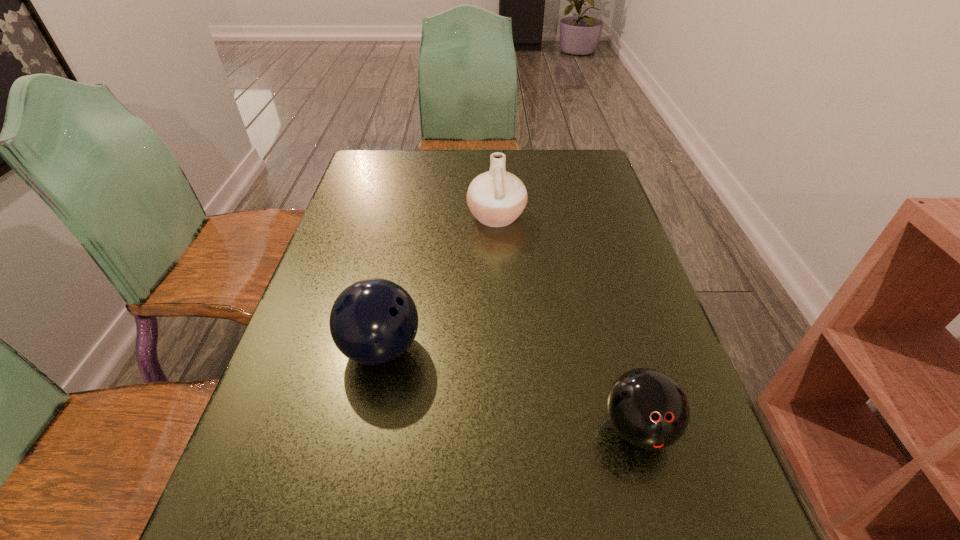
This screenshot has height=540, width=960. Identify the location of free space between the leftmost object and the second object from left to right. (439, 282).

The image size is (960, 540). In order to click on blank region between the second nearest object and the nearest object in this screenshot , I will do `click(510, 388)`.

I want to click on vacant space that's between the shorter bowling ball and the pottery, so click(x=567, y=322).

This screenshot has width=960, height=540. Find the location of `free space between the left bowling ball and the second object from left to right`. free space between the left bowling ball and the second object from left to right is located at coordinates (439, 282).

Where is `empty space between the taller bowling ball and the pottery`? empty space between the taller bowling ball and the pottery is located at coordinates (439, 282).

This screenshot has height=540, width=960. Find the location of `free space between the nearest object and the second farthest object`. free space between the nearest object and the second farthest object is located at coordinates (510, 388).

The image size is (960, 540). What are the coordinates of `free spot between the second nearest object and the farthest object` in the screenshot? It's located at (439, 282).

Find the location of `the closest object relative to the left bowling ball`. the closest object relative to the left bowling ball is located at coordinates (496, 198).

Where is `object identified as the closest to the left bowling ball`? object identified as the closest to the left bowling ball is located at coordinates (496, 198).